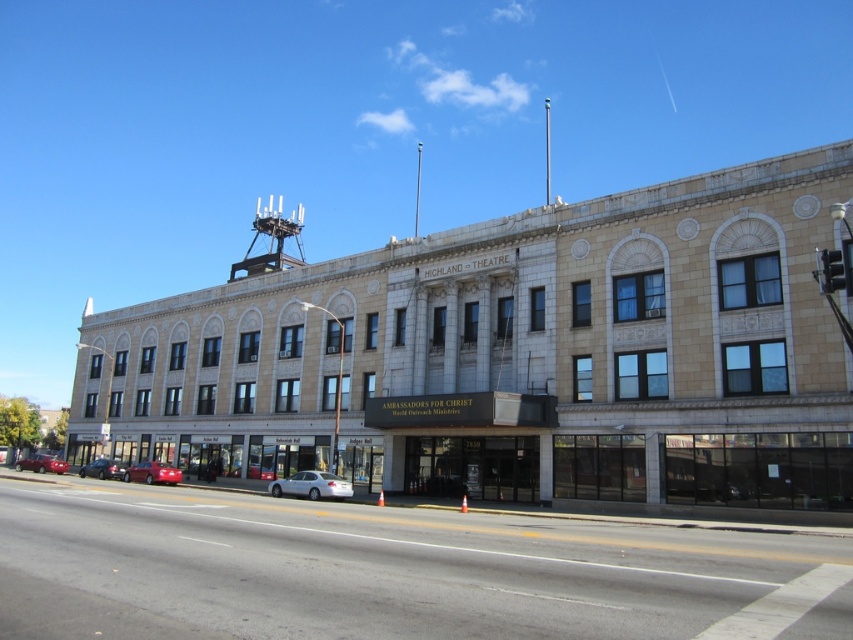
You are standing at the entrance of the HIGHLAND THEATRE and want to cross the street to reach the park on the other side. The crosswalk is located at the point with coordinates 0.759, 0.366. Is the silver metallic sedan at center blocking your path to the crosswalk?

The silver metallic sedan at center is located exactly at the crosswalk coordinates (311, 484), so it is blocking your path to the crosswalk.

You are a delivery person needing to park your 2.5 meter wide van in the street. The parking spot between the metallic red car at lower left and the shiny black sedan at lower left is available. Can your van fit there?

The metallic red car at lower left is wider than the shiny black sedan at lower left. The combined width of both cars would determine the available space. However, since the metallic red car is wider, the space between them might be sufficient for a 2.5 meter van. Without exact measurements, it is uncertain, but based on the description, the metallic red car at lower left is wider, so the space between them may accommodate your van.